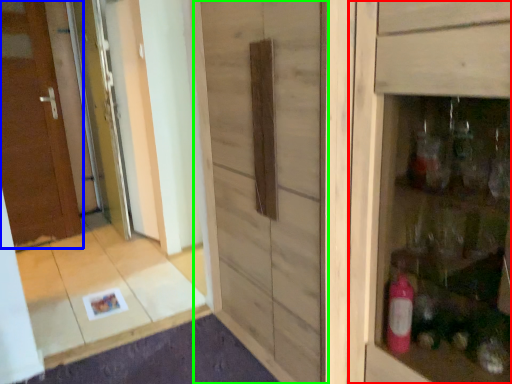
Question: Which object is positioned closest to cabinetry (highlighted by a red box)? Select from door (highlighted by a blue box) and barn door (highlighted by a green box).

Choices:
 (A) door
 (B) barn door

Answer: (B)